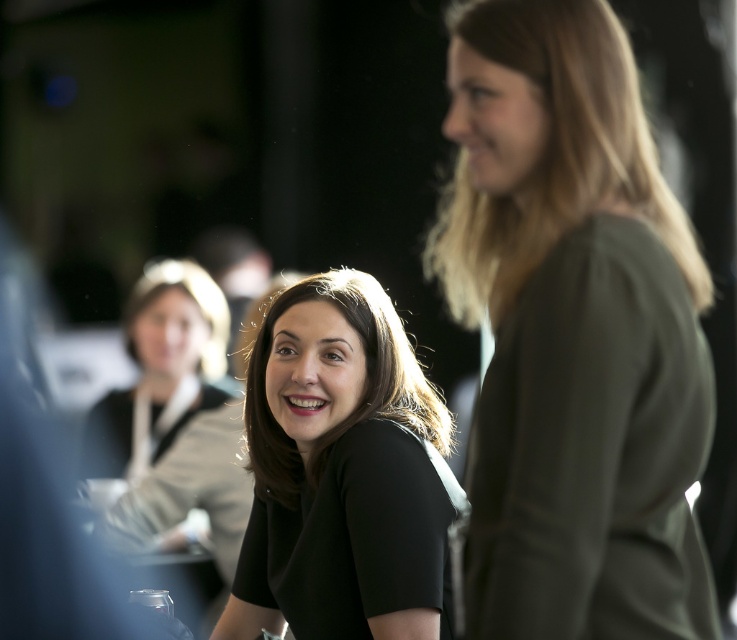
Can you confirm if black matte shirt at center is positioned to the left of matte black shirt at center?

No, black matte shirt at center is not to the left of matte black shirt at center.

Who is positioned more to the left, black matte shirt at center or matte black shirt at center?

From the viewer's perspective, matte black shirt at center appears more on the left side.

Does point (352, 557) come in front of point (157, 504)?

Yes, it is in front of point (157, 504).

Find the location of a particular element. black matte shirt at center is located at coordinates (338, 465).

Is olive green jersey at right in front of black matte shirt at center?

That is True.

Consider the image. Does olive green jersey at right have a smaller size compared to black matte shirt at center?

Yes.

I want to click on olive green jersey at right, so [579, 349].

Looking at this image, can you confirm if olive green jersey at right is positioned below matte black shirt at center?

Incorrect, olive green jersey at right is not positioned below matte black shirt at center.

Between olive green jersey at right and matte black shirt at center, which one is positioned higher?

olive green jersey at right is above.

The height and width of the screenshot is (640, 737). I want to click on olive green jersey at right, so click(579, 349).

Where is `olive green jersey at right`? This screenshot has height=640, width=737. olive green jersey at right is located at coordinates (579, 349).